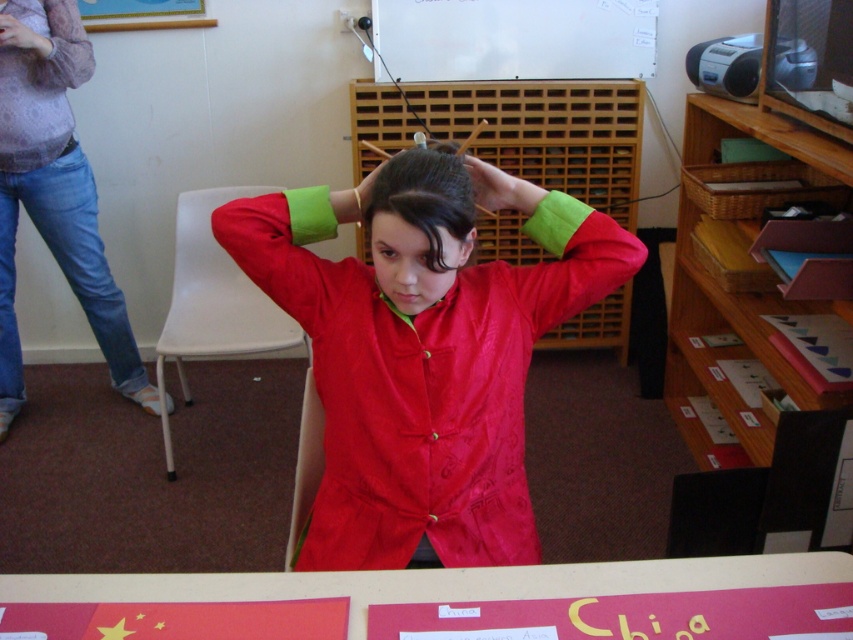
Question: Is matte purple blouse at upper left positioned behind white matte board at upper center?

Choices:
 (A) yes
 (B) no

Answer: (B)

Question: Can you confirm if matte purple blouse at upper left is thinner than white matte board at upper center?

Choices:
 (A) no
 (B) yes

Answer: (B)

Question: Can you confirm if matte red jacket at center is bigger than matte red hand at upper center?

Choices:
 (A) no
 (B) yes

Answer: (B)

Question: Which object appears farthest from the camera in this image?

Choices:
 (A) white matte board at upper center
 (B) matte red hand at upper center

Answer: (A)

Question: Which object appears farthest from the camera in this image?

Choices:
 (A) matte black hand at upper left
 (B) shiny red jacket at center

Answer: (A)

Question: Which point is farther to the camera?

Choices:
 (A) matte red jacket at center
 (B) matte green hair at center

Answer: (B)